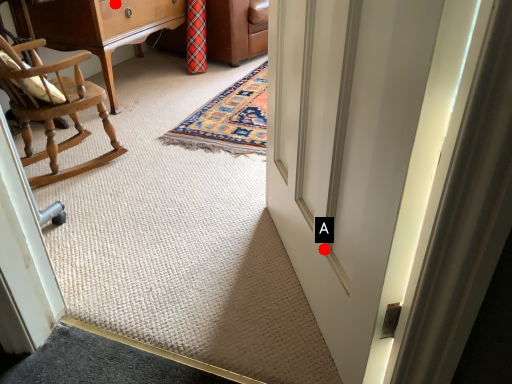
Question: Two points are circled on the image, labeled by A and B beside each circle. Among these points, which one is farthest from the camera?

Choices:
 (A) A is further
 (B) B is further

Answer: (B)